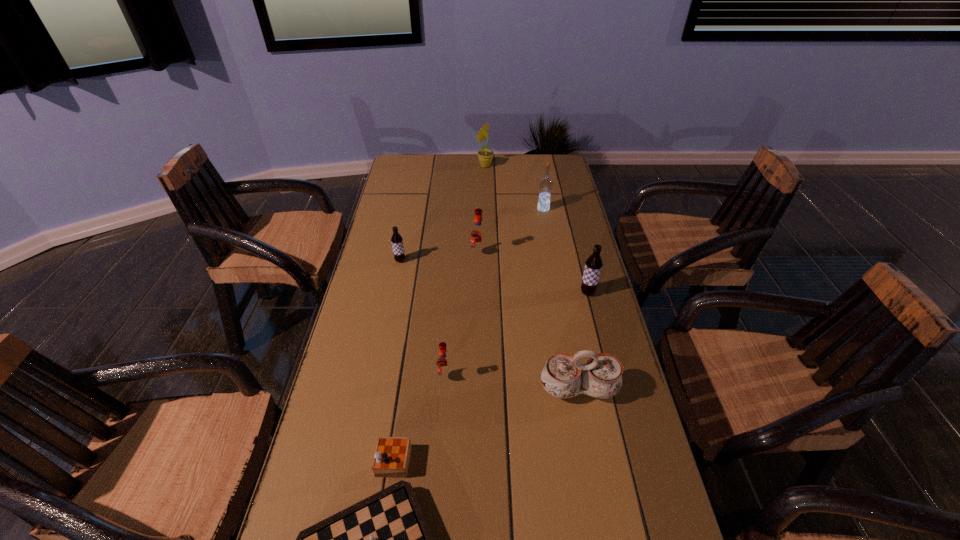
Locate an element on the screen. the farther brown root beer is located at coordinates (397, 241).

Image resolution: width=960 pixels, height=540 pixels. Identify the location of the second root beer from left to right. (444, 364).

Find the location of `the nearer red root beer`. the nearer red root beer is located at coordinates (444, 364).

Find the location of a particular element. vacant space situated on the face of the yellow sunflower is located at coordinates pos(407,166).

The image size is (960, 540). Identify the location of vacant space located 0.110m on the face of the yellow sunflower. (451, 166).

Find the location of a particular element. The width and height of the screenshot is (960, 540). free space located on the face of the yellow sunflower is located at coordinates (431, 166).

This screenshot has height=540, width=960. In order to click on vacant position located on the left of the blue vodka in this screenshot , I will do `click(468, 209)`.

Where is `free spot located on the back of the farther red root beer`? The width and height of the screenshot is (960, 540). free spot located on the back of the farther red root beer is located at coordinates (479, 239).

Identify the location of vacant point located on the left of the rightmost root beer. The width and height of the screenshot is (960, 540). (468, 293).

Where is `free spot located by the handle of the white chinaware`? This screenshot has height=540, width=960. free spot located by the handle of the white chinaware is located at coordinates [593, 469].